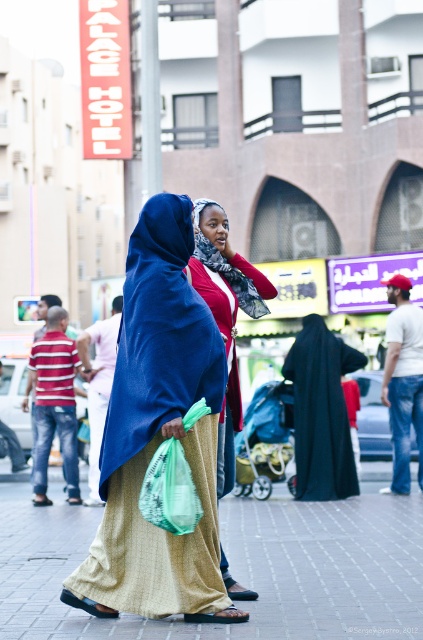
You are a photographer standing in the middle of the street. You want to take a photo that includes both point (126,448) and point (203,237). Which point will appear larger in your photo?

Point (126,448) is closer to the camera than point (203,237), so it will appear larger in the photo.

Please look at the scene described. There is a point marked at coordinates (321,412). What object is located at this point?

The point at coordinates (321,412) indicates the location of the black matte robe at center.

You are a photographer trying to capture a candid shot of the two women in the scene. You want to ensure that the blue woven shawl at center and the matte red scarf at center are both visible in the frame. Based on their positions, which scarf should you focus on first to ensure both are in the shot?

The blue woven shawl at center is to the left of the matte red scarf at center, so focusing on the blue woven shawl at center first would allow you to frame both scarves in the shot since it is positioned to the left of the other.